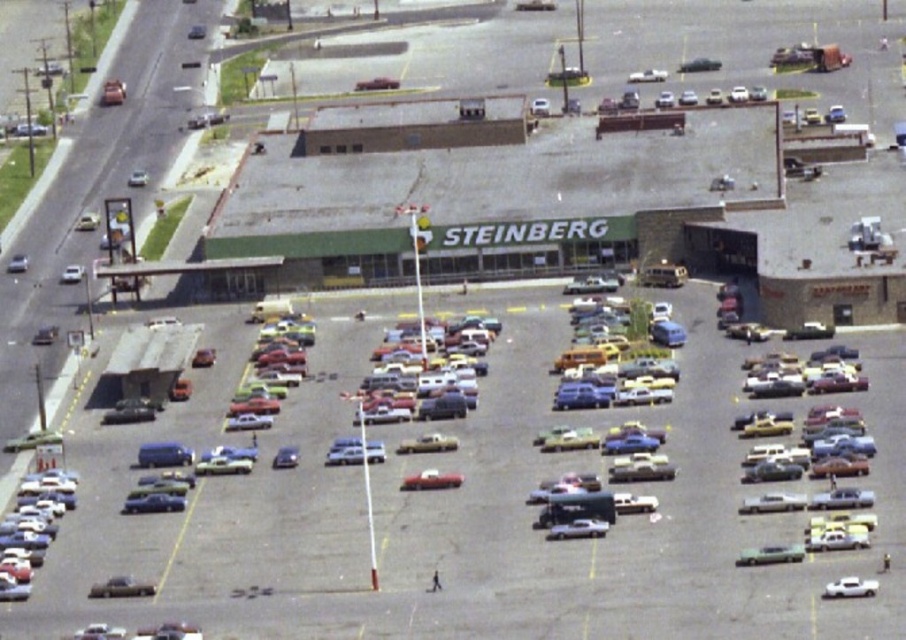
Is matte black car at center shorter than metallic silver car at lower left?

Correct, matte black car at center is not as tall as metallic silver car at lower left.

In order to click on matte black car at center in this screenshot , I will do `click(376, 83)`.

This screenshot has width=906, height=640. Identify the location of matte black car at center. (376, 83).

Is shiny silver car at center taller than metallic silver car at lower left?

Yes.

Who is lower down, shiny silver car at center or metallic silver car at lower left?

shiny silver car at center

Image resolution: width=906 pixels, height=640 pixels. What do you see at coordinates (577, 529) in the screenshot?
I see `shiny silver car at center` at bounding box center [577, 529].

Identify the location of shiny silver car at center. (577, 529).

Who is positioned more to the left, shiny silver car at lower left or shiny silver car at center?

From the viewer's perspective, shiny silver car at lower left appears more on the left side.

Which is in front, point (116, 593) or point (560, 524)?

Point (116, 593) is more forward.

This screenshot has height=640, width=906. Identify the location of shiny silver car at lower left. (121, 588).